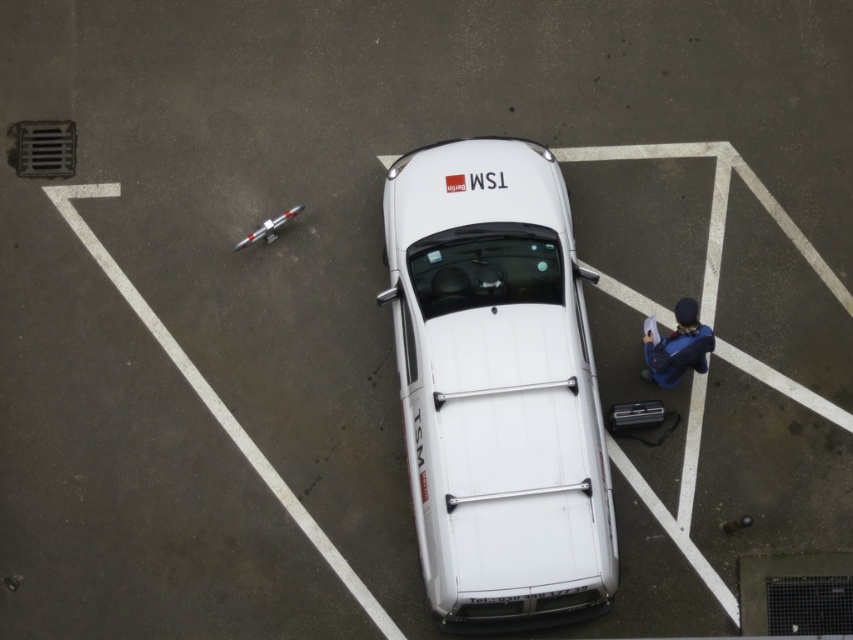
Question: Where is white matte van at center located in relation to blue fabric jacket at lower right in the image?

Choices:
 (A) below
 (B) above

Answer: (A)

Question: Which point is farther to the camera?

Choices:
 (A) white matte van at center
 (B) blue fabric jacket at lower right

Answer: (B)

Question: Can you confirm if white matte van at center is thinner than blue fabric jacket at lower right?

Choices:
 (A) no
 (B) yes

Answer: (A)

Question: Can you confirm if white matte van at center is positioned below blue fabric jacket at lower right?

Choices:
 (A) no
 (B) yes

Answer: (B)

Question: Among these objects, which one is farthest from the camera?

Choices:
 (A) blue fabric jacket at lower right
 (B) white matte van at center

Answer: (A)